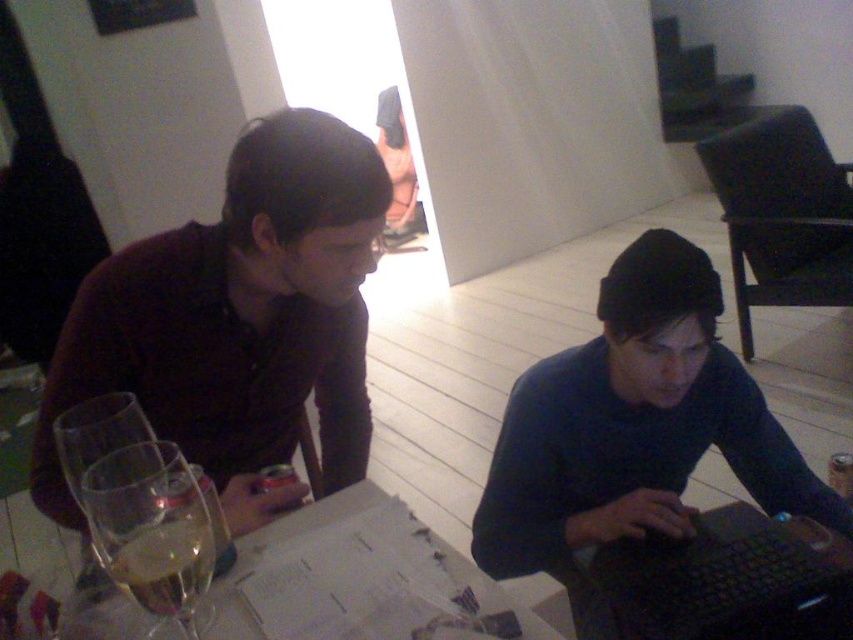
Is the position of matte black shirt at left less distant than that of clear glass wine glass at lower left?

No, it is not.

Does matte black shirt at left have a greater height compared to clear glass wine glass at lower left?

Indeed, matte black shirt at left has a greater height compared to clear glass wine glass at lower left.

Between point (258, 392) and point (172, 468), which one is positioned behind?

The point (258, 392) is more distant.

Locate an element on the screen. matte black shirt at left is located at coordinates (238, 321).

Can you confirm if matte black shirt at left is positioned to the right of black matte laptop at lower right?

No, matte black shirt at left is not to the right of black matte laptop at lower right.

In the scene shown: Is matte black shirt at left thinner than black matte laptop at lower right?

Incorrect, matte black shirt at left's width is not less than black matte laptop at lower right's.

Who is more distant from viewer, (193, 330) or (732, 602)?

The point (193, 330) is more distant.

I want to click on matte black shirt at left, so click(x=238, y=321).

Between point (686, 541) and point (183, 572), which one is positioned in front?

Positioned in front is point (183, 572).

Does point (689, 616) lie behind point (115, 520)?

Yes.

Is point (651, 627) positioned in front of point (206, 524)?

No, (651, 627) is further to viewer.

At what (x,y) coordinates should I click in order to perform the action: click on black matte laptop at lower right. Please return your answer as a coordinate pair (x, y). The width and height of the screenshot is (853, 640). Looking at the image, I should click on (724, 579).